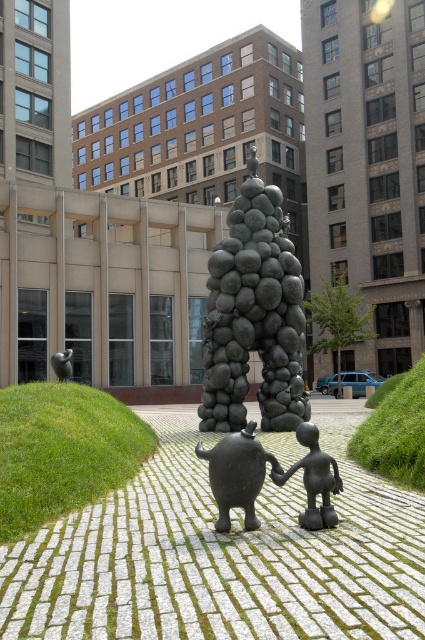
You are an architect analyzing the spatial relationship between two points in the sculpture. Which point, point 1 at coordinates (336, 492) or point 2 at coordinates (59, 369), is closer to the viewer?

Point 1 at coordinates (336, 492) is closer to the viewer than point 2 at coordinates (59, 369).

You are an art curator planning to move the matte black sculpture at center and the matte black figure at center to a new exhibition space. The new space has a restricted area where only one of them can be placed in the central display. Based on their positions in the original image, which one should be prioritized for the central position?

The matte black sculpture at center should be prioritized for the central position because it is positioned over the matte black figure at center, indicating it is the primary focal point.

You are standing 10 feet away from the camera. Can you see the matte black figure at center clearly?

The matte black figure at center is 15.15 feet away from the camera. Since you are standing 10 feet away from the camera, you are closer to the camera than the figure. Therefore, you can see the matte black figure at center clearly as it is within your line of sight.